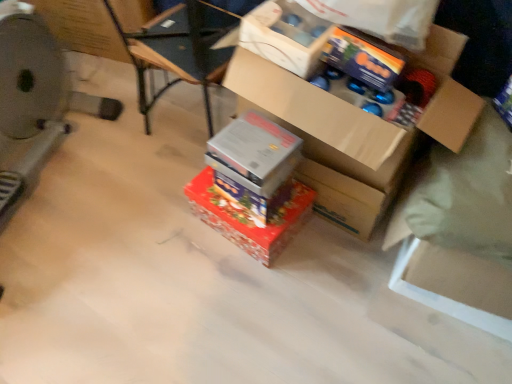
Question: Choose the correct answer: Is shiny metallic box at center, the first box in the bottom-to-top sequence, inside cardboard box at center, which appears as the 1th box when viewed from the top, or outside it?

Choices:
 (A) inside
 (B) outside

Answer: (B)

Question: Is shiny metallic box at center, the first box in the bottom-to-top sequence, in front of or behind cardboard box at center, positioned as the third box in bottom-to-top order, in the image?

Choices:
 (A) front
 (B) behind

Answer: (B)

Question: Estimate the real-world distances between objects in this image. Which object is closer to the cardboard box at upper center?

Choices:
 (A) metallic silver box at center, the second box positioned from the top
 (B) shiny metallic box at center, positioned as the 3th box in top-to-bottom order
 (C) metallic silver exercise machine at left
 (D) shiny orange wrapping paper at upper center
 (E) cardboard box at upper left

Answer: (D)

Question: Considering the real-world distances, which object is farthest from the shiny metallic box at center, the first box in the bottom-to-top sequence?

Choices:
 (A) metallic silver box at center, which appears as the second box when ordered from the bottom
 (B) cardboard box at upper center
 (C) shiny orange wrapping paper at upper center
 (D) cardboard box at upper left
 (E) metallic silver exercise machine at left

Answer: (D)